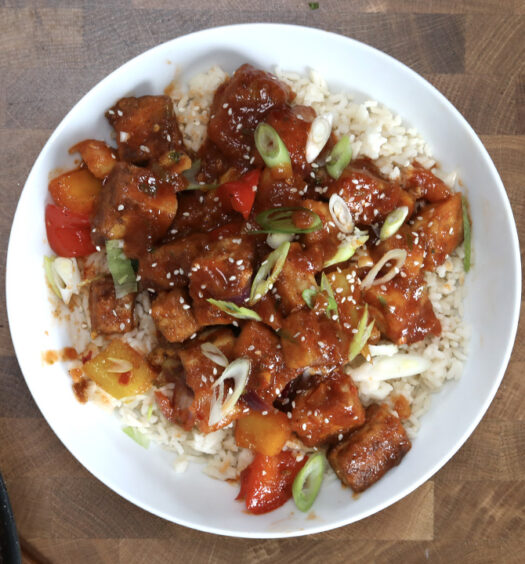
Find the location of a particular element. The width and height of the screenshot is (525, 564). edge of table is located at coordinates (30, 549).